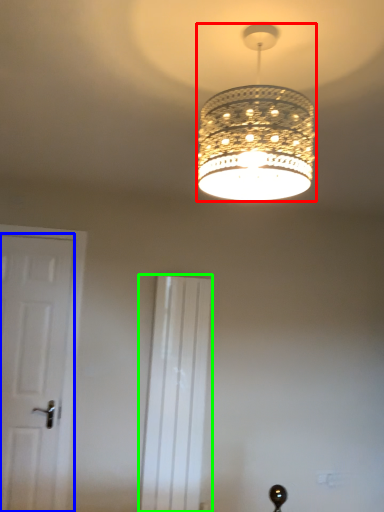
Question: Which object is the farthest from lamp (highlighted by a red box)? Choose among these: door (highlighted by a blue box) or screen door (highlighted by a green box).

Choices:
 (A) door
 (B) screen door

Answer: (A)